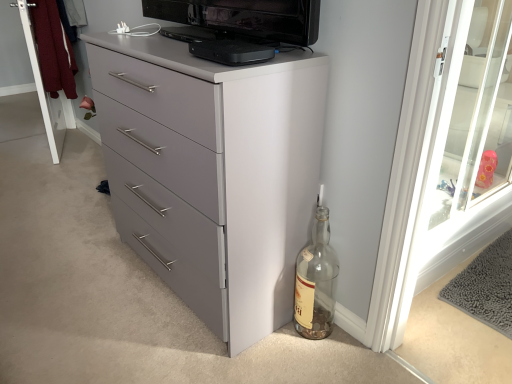
Question: Does transparent glass screen door at upper right, which is the 1th screen door in right-to-left order, have a lesser width compared to white wood screen door at upper left, which is counted as the second screen door, starting from the right?

Choices:
 (A) no
 (B) yes

Answer: (B)

Question: Is transparent glass screen door at upper right, which is the 1th screen door in right-to-left order, behind white wood screen door at upper left, placed as the first screen door when sorted from left to right?

Choices:
 (A) no
 (B) yes

Answer: (A)

Question: Is white wood screen door at upper left, placed as the first screen door when sorted from left to right, inside transparent glass screen door at upper right, which is counted as the 1th screen door, starting from the front?

Choices:
 (A) yes
 (B) no

Answer: (B)

Question: Is transparent glass screen door at upper right, which is the 1th screen door in right-to-left order, taller than white wood screen door at upper left, placed as the first screen door when sorted from left to right?

Choices:
 (A) yes
 (B) no

Answer: (A)

Question: Is transparent glass screen door at upper right, the 2th screen door from the back, wider than white wood screen door at upper left, positioned as the second screen door in front-to-back order?

Choices:
 (A) no
 (B) yes

Answer: (A)

Question: Can you confirm if transparent glass screen door at upper right, which is counted as the 1th screen door, starting from the front, is positioned to the right of white wood screen door at upper left, positioned as the second screen door in front-to-back order?

Choices:
 (A) yes
 (B) no

Answer: (A)

Question: From a real-world perspective, is transparent glass screen door at upper right, which is counted as the 1th screen door, starting from the front, on top of clear glass bottle at lower right?

Choices:
 (A) yes
 (B) no

Answer: (A)

Question: Can you confirm if transparent glass screen door at upper right, which is the 2th screen door in left-to-right order, is taller than clear glass bottle at lower right?

Choices:
 (A) yes
 (B) no

Answer: (A)

Question: From a real-world perspective, does transparent glass screen door at upper right, which is counted as the 1th screen door, starting from the front, sit lower than clear glass bottle at lower right?

Choices:
 (A) no
 (B) yes

Answer: (A)

Question: Can you confirm if transparent glass screen door at upper right, which is the 2th screen door in left-to-right order, is smaller than clear glass bottle at lower right?

Choices:
 (A) yes
 (B) no

Answer: (B)

Question: Is transparent glass screen door at upper right, which is the 1th screen door in right-to-left order, located outside clear glass bottle at lower right?

Choices:
 (A) yes
 (B) no

Answer: (A)

Question: From the image's perspective, is transparent glass screen door at upper right, the 2th screen door from the back, on clear glass bottle at lower right?

Choices:
 (A) yes
 (B) no

Answer: (A)

Question: Is black plastic device at upper center closer to camera compared to transparent glass screen door at upper right, which is the 2th screen door in left-to-right order?

Choices:
 (A) no
 (B) yes

Answer: (B)